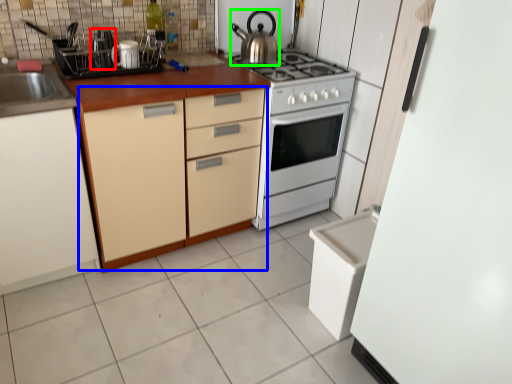
Question: Estimate the real-world distances between objects in this image. Which object is farther from appliance (highlighted by a red box), cabinetry (highlighted by a blue box) or kitchen appliance (highlighted by a green box)?

Choices:
 (A) cabinetry
 (B) kitchen appliance

Answer: (B)